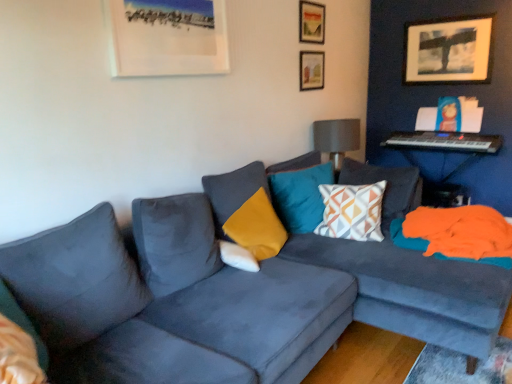
Question: Is white soft pillow at center, the first pillow positioned from the left, to the right of wooden picture frame at upper right, which appears as the 4th picture frame when viewed from the front, from the viewer's perspective?

Choices:
 (A) yes
 (B) no

Answer: (B)

Question: Would you say white soft pillow at center, which is the 4th pillow in right-to-left order, contains wooden picture frame at upper right, the first picture frame when ordered from back to front?

Choices:
 (A) no
 (B) yes

Answer: (A)

Question: Is wooden picture frame at upper right, which is the 1th picture frame in right-to-left order, at the back of white soft pillow at center, which is the 4th pillow in right-to-left order?

Choices:
 (A) no
 (B) yes

Answer: (A)

Question: Does white soft pillow at center, the first pillow positioned from the left, have a smaller size compared to wooden picture frame at upper right, which ranks as the 4th picture frame in left-to-right order?

Choices:
 (A) no
 (B) yes

Answer: (B)

Question: Is white soft pillow at center, which is the 4th pillow in right-to-left order, facing towards wooden picture frame at upper right, the first picture frame when ordered from back to front?

Choices:
 (A) no
 (B) yes

Answer: (A)

Question: From the image's perspective, is teal velvet pillow at center, which is the 3th pillow from left to right, positioned above or below matte gray lampshade at upper right?

Choices:
 (A) below
 (B) above

Answer: (A)

Question: Is teal velvet pillow at center, which is the 3th pillow from left to right, taller or shorter than matte gray lampshade at upper right?

Choices:
 (A) short
 (B) tall

Answer: (B)

Question: In terms of size, does teal velvet pillow at center, which is the 3th pillow from left to right, appear bigger or smaller than matte gray lampshade at upper right?

Choices:
 (A) big
 (B) small

Answer: (B)

Question: Is point (291, 213) positioned closer to the camera than point (344, 147)?

Choices:
 (A) closer
 (B) farther

Answer: (A)

Question: Considering the relative positions of geometric-patterned fabric pillow at center, marked as the fourth pillow in a left-to-right arrangement, and matte white picture frame at upper left, the fourth picture frame from the right, in the image provided, is geometric-patterned fabric pillow at center, marked as the fourth pillow in a left-to-right arrangement, to the left or to the right of matte white picture frame at upper left, the fourth picture frame from the right,?

Choices:
 (A) right
 (B) left

Answer: (A)

Question: Is geometric-patterned fabric pillow at center, marked as the fourth pillow in a left-to-right arrangement, situated inside matte white picture frame at upper left, the first picture frame in the front-to-back sequence, or outside?

Choices:
 (A) inside
 (B) outside

Answer: (B)

Question: From the image's perspective, is geometric-patterned fabric pillow at center, the first pillow from the right, positioned above or below matte white picture frame at upper left, the 4th picture frame when ordered from back to front?

Choices:
 (A) above
 (B) below

Answer: (B)

Question: From a real-world perspective, relative to matte white picture frame at upper left, the 4th picture frame when ordered from back to front, is geometric-patterned fabric pillow at center, the first pillow from the right, vertically above or below?

Choices:
 (A) above
 (B) below

Answer: (B)

Question: Is geometric-patterned fabric pillow at center, the first pillow from the right, to the left or to the right of metallic silver keyboard at upper right in the image?

Choices:
 (A) right
 (B) left

Answer: (B)

Question: In the image, is geometric-patterned fabric pillow at center, marked as the fourth pillow in a left-to-right arrangement, positioned in front of or behind metallic silver keyboard at upper right?

Choices:
 (A) behind
 (B) front

Answer: (B)